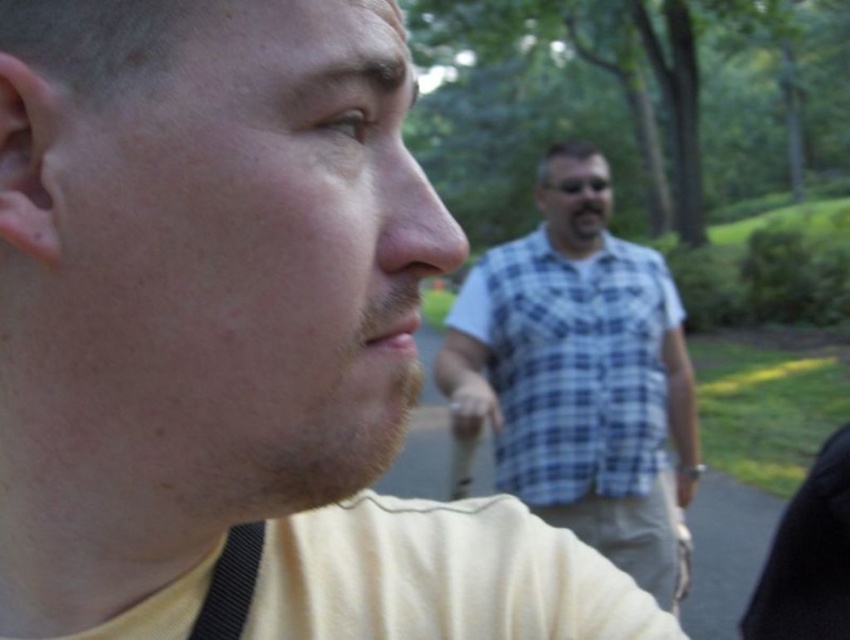
Based on the scene described, which object is wider, the blue plaid shirt at center or the black fabric strap at lower left?

The blue plaid shirt at center is wider than the black fabric strap at lower left according to the description.

You are standing in a park and see a person wearing a blue plaid shirt at center. If you want to take a photo of them, where should you aim your camera?

You should aim your camera at point (581,376) to capture the blue plaid shirt at center.

You are standing at the point marked as point (x=581, y=376) in the image. What object is located exactly at this point?

The blue plaid shirt at center is located exactly at point (x=581, y=376).